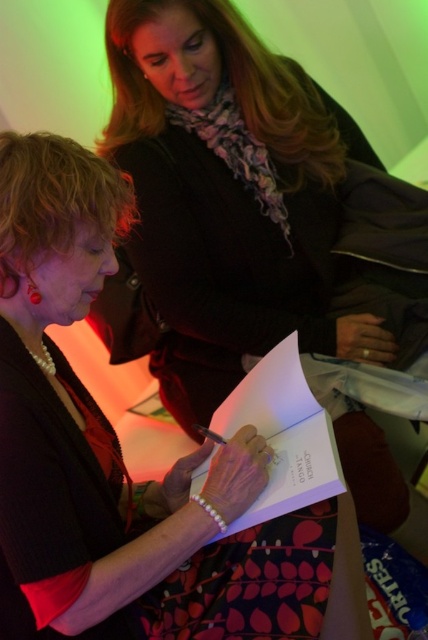
Does matte black book at center have a smaller size compared to white paper book at center?

No, matte black book at center is not smaller than white paper book at center.

Who is shorter, matte black book at center or white paper book at center?

white paper book at center is shorter.

Is point (14, 250) less distant than point (309, 500)?

Yes, point (14, 250) is in front of point (309, 500).

Find the location of a particular element. The width and height of the screenshot is (428, 640). matte black book at center is located at coordinates (121, 460).